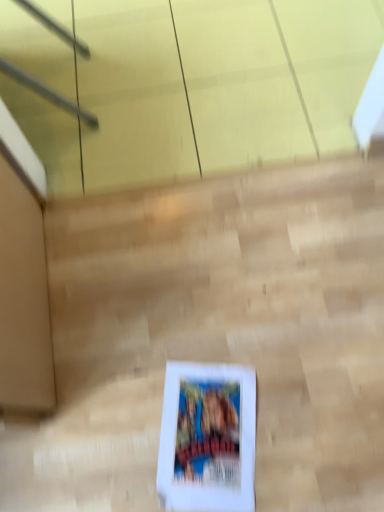
Question: Should I look upward or downward to see white cardboard box at center?

Choices:
 (A) down
 (B) up

Answer: (A)

Question: Is white paper at center looking in the opposite direction of white cardboard box at center?

Choices:
 (A) yes
 (B) no

Answer: (A)

Question: Is white paper at center wider than white cardboard box at center?

Choices:
 (A) yes
 (B) no

Answer: (B)

Question: Does white paper at center have a larger size compared to white cardboard box at center?

Choices:
 (A) yes
 (B) no

Answer: (B)

Question: From a real-world perspective, is white paper at center physically above white cardboard box at center?

Choices:
 (A) no
 (B) yes

Answer: (A)

Question: From the image's perspective, is white paper at center located beneath white cardboard box at center?

Choices:
 (A) yes
 (B) no

Answer: (A)

Question: From the image's perspective, does white paper at center appear higher than white cardboard box at center?

Choices:
 (A) no
 (B) yes

Answer: (A)

Question: Is white cardboard box at center far away from white paper at center?

Choices:
 (A) yes
 (B) no

Answer: (B)

Question: Does white cardboard box at center lie in front of white paper at center?

Choices:
 (A) yes
 (B) no

Answer: (A)

Question: Is white cardboard box at center bigger than white paper at center?

Choices:
 (A) yes
 (B) no

Answer: (A)

Question: Is white cardboard box at center aimed at white paper at center?

Choices:
 (A) yes
 (B) no

Answer: (A)

Question: From a real-world perspective, is white cardboard box at center positioned over white paper at center based on gravity?

Choices:
 (A) yes
 (B) no

Answer: (A)

Question: From the image's perspective, is white cardboard box at center below white paper at center?

Choices:
 (A) yes
 (B) no

Answer: (B)

Question: Looking at the image, does white paper at center seem bigger or smaller compared to white cardboard box at center?

Choices:
 (A) big
 (B) small

Answer: (B)